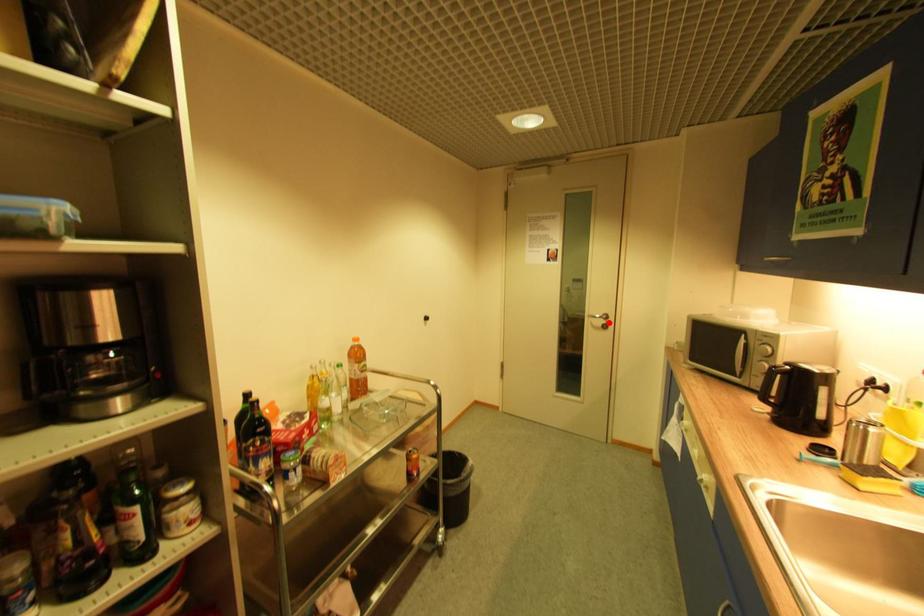
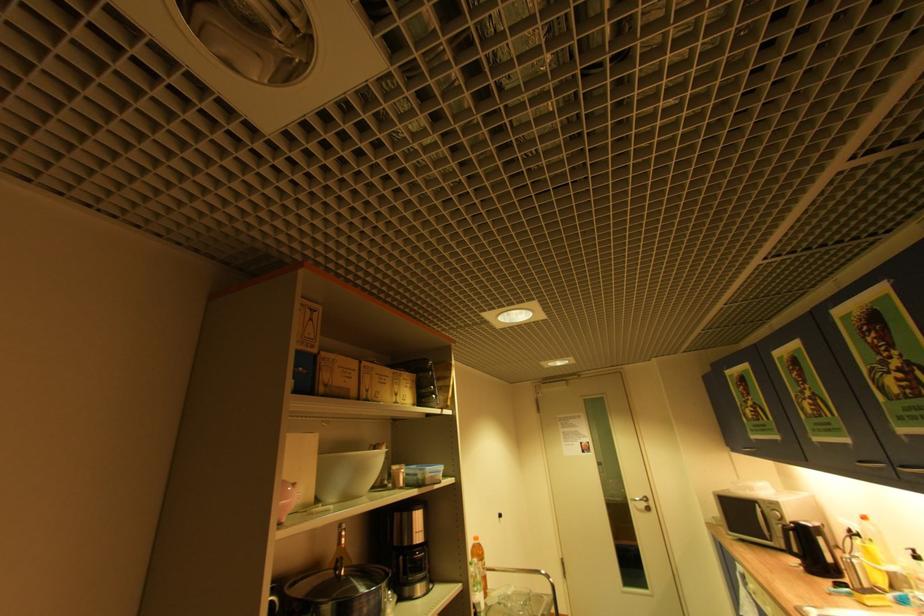
Find the pixel in the second image that matches the highlighted location in the first image.

(650, 505)